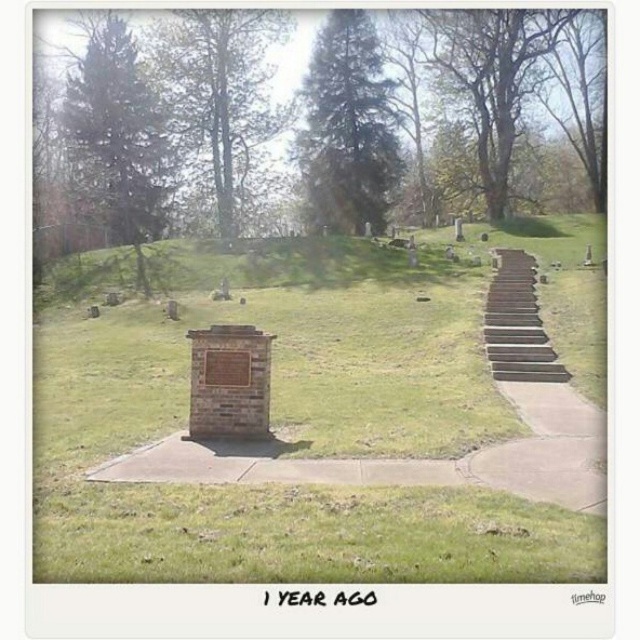
Is point (102, 324) positioned behind point (525, 273)?

That is False.

Between green grassy at center and wooden stairs at right, which one has less height?

Standing shorter between the two is wooden stairs at right.

Describe the element at coordinates (294, 442) in the screenshot. This screenshot has height=640, width=640. I see `green grassy at center` at that location.

I want to click on green grassy at center, so click(294, 442).

Is brown wooden stairs at right taller than wooden stairs at right?

No.

Does point (564, 500) come in front of point (515, 348)?

Yes, point (564, 500) is closer to viewer.

Find the location of a particular element. brown wooden stairs at right is located at coordinates (536, 403).

In the scene shown: Between green grassy at center and brown wooden stairs at right, which one appears on the left side from the viewer's perspective?

green grassy at center

The image size is (640, 640). What are the coordinates of `green grassy at center` in the screenshot? It's located at (294, 442).

Who is more forward, (112, 413) or (554, 362)?

Positioned in front is point (112, 413).

You are a GUI agent. You are given a task and a screenshot of the screen. Output one action in this format:
    pyautogui.click(x=<x>, y=<y>)
    Task: Click on the green grassy at center
    The width and height of the screenshot is (640, 640).
    Given the screenshot: What is the action you would take?
    pyautogui.click(x=294, y=442)